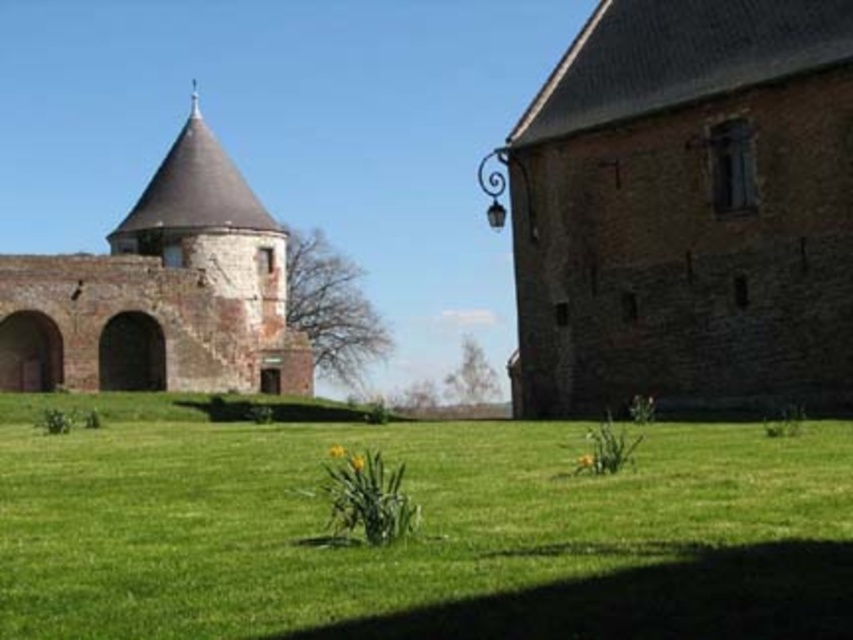
You are standing at the base of the historic round tower and want to walk to the green grass at center. Based on the coordinates provided, in which direction should you head relative to the tower?

The green grass at center is located at coordinates point (x=422, y=532), so you should head to the right of the tower to reach it.

You are standing in front of the historic building with the round tower. There is a point marked at coordinates (422, 532). What is located at that point?

→ The point at coordinates (422, 532) corresponds to green grass at center.

In the scene shown: You are standing at the base of the historic round tower in the image. Looking towards the center of the scene, you see a point labeled as point (422, 532). What is located at that point?

The point (422, 532) is where the green grass at center is located.